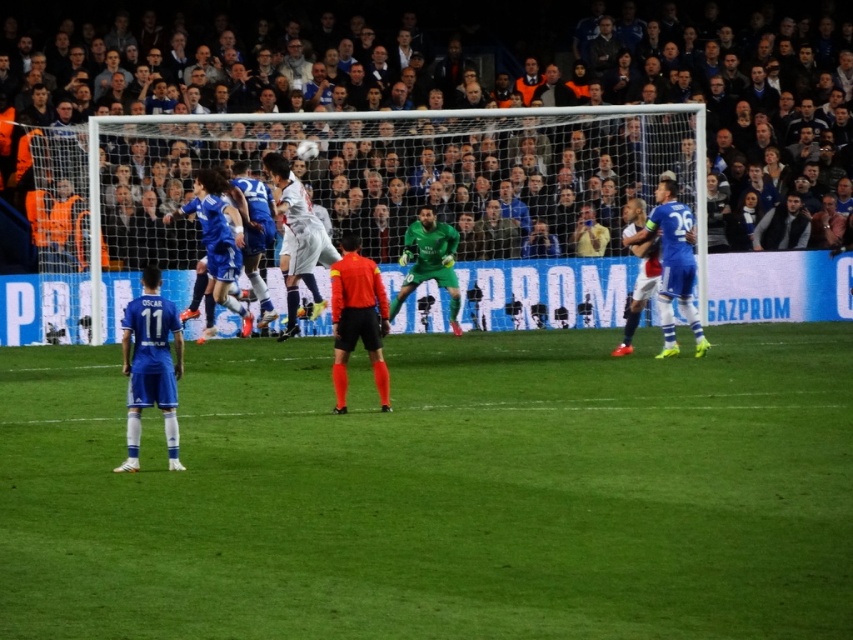
You are a soccer coach analyzing the game footage. You see two points marked on the field, point 1 at coordinates (175, 339) and point 2 at (363, 333). Which point is closer to the camera?

Point 1 at coordinates (175, 339) is closer to the viewer than point 2 at (363, 333).

What is the exact coordinate of the green grass football field at center?

The green grass football field at center is located at point [438,492].

You are a soccer coach analyzing the field layout. The green grass football field at center and the blue jersey at lower left are both visible. Which object is wider?

The green grass football field at center is wider than the blue jersey at lower left.